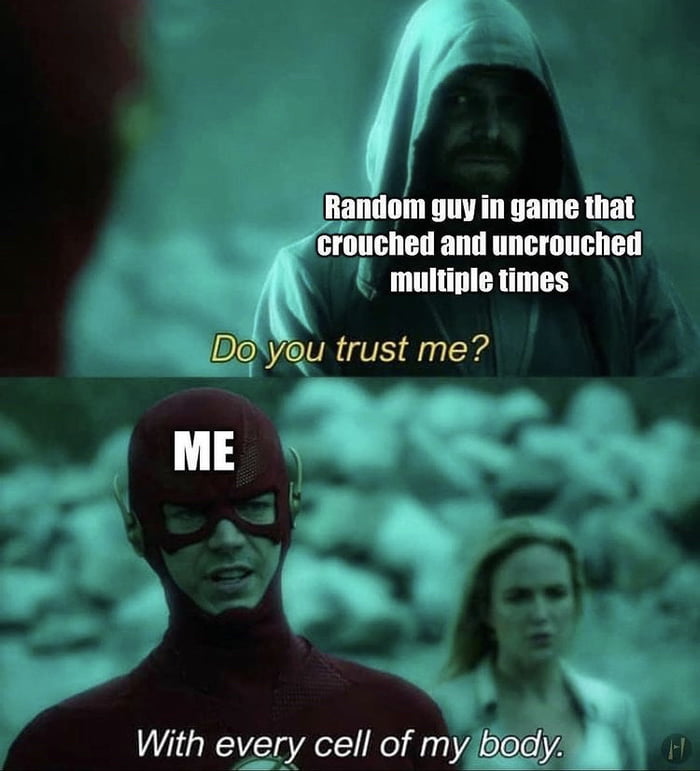
Locate an element on the screen. hood is located at coordinates (524, 48).